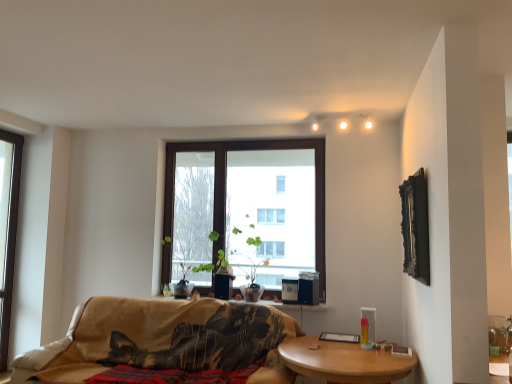
Question: Based on their positions, is beige fabric couch at center located to the left or right of black wood picture frame at upper right?

Choices:
 (A) right
 (B) left

Answer: (B)

Question: Does point (134, 309) appear closer or farther from the camera than point (420, 278)?

Choices:
 (A) closer
 (B) farther

Answer: (B)

Question: Which object is the closest to the beige fabric couch at center?

Choices:
 (A) matte white light bulb at upper center
 (B) clear glass window at left, marked as the second window in a right-to-left arrangement
 (C) brown wooden window at center, the second window when ordered from left to right
 (D) black wood picture frame at upper right
 (E) wooden at lower right

Answer: (E)

Question: Estimate the real-world distances between objects in this image. Which object is closer to the black wood picture frame at upper right?

Choices:
 (A) velvet black blanket at center
 (B) beige fabric couch at center
 (C) matte white light bulb at upper center
 (D) wooden at lower right
 (E) green leafy plant at center

Answer: (D)